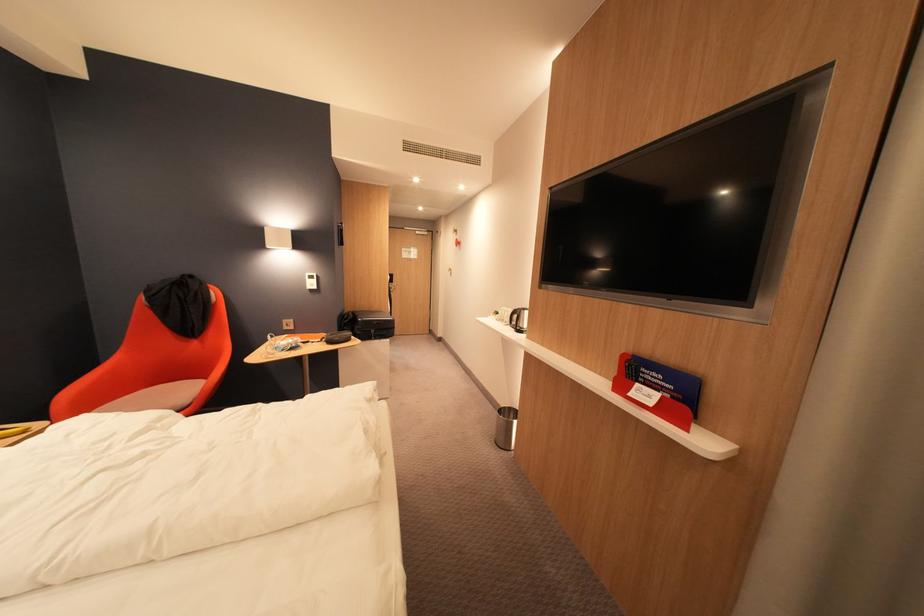
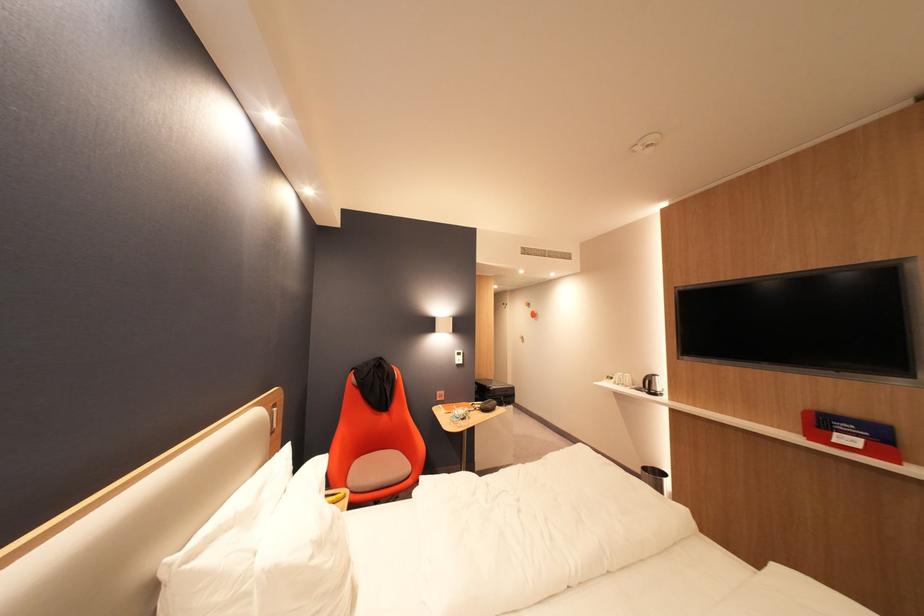
The point at (x=506, y=315) is marked in the first image. Where is the corresponding point in the second image?

(622, 379)